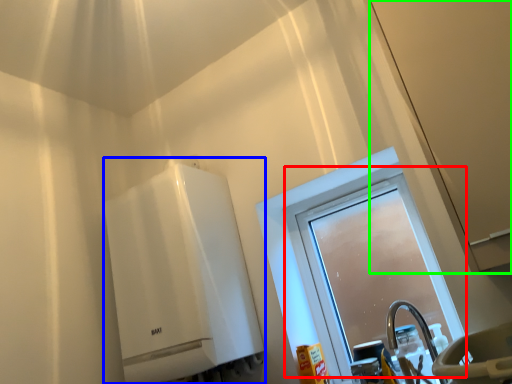
Question: Which is farther away from window (highlighted by a red box)? water heater (highlighted by a blue box) or screen door (highlighted by a green box)?

Choices:
 (A) water heater
 (B) screen door

Answer: (B)